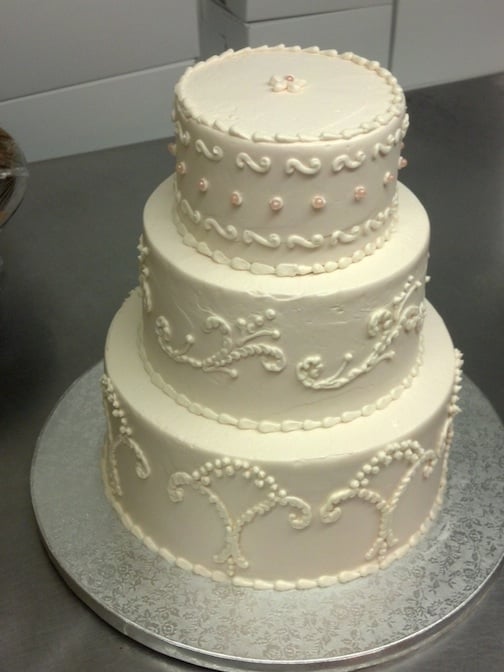
Locate an element on the screen. Image resolution: width=504 pixels, height=672 pixels. silver metal counter is located at coordinates (78, 632), (473, 644), (474, 316), (51, 372).